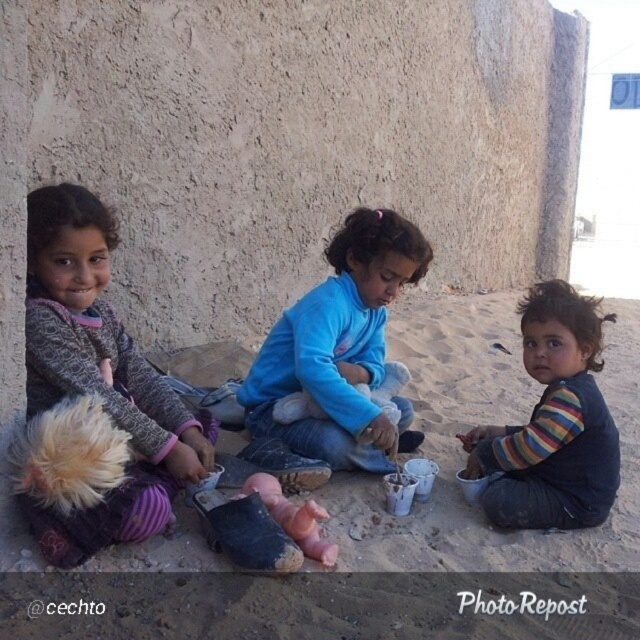
You are a photographer standing in front of the three children. You want to focus your camera on the point closer to you between point [388,524] and point [506,428]. Which point should you choose?

Point [388,524] is closer to the camera than point [506,428], so you should focus on point [388,524].

You are a photographer setting up a tripod to take a group photo of the children. The tripod has a width of 1.2 meters. You want to position the tripod so that it fits between the blue fleece jacket at center and the knitted gray sweater at left without overlapping either. Based on the scene description, is this possible?

The blue fleece jacket at center might be wider than knitted gray sweater at left, so the distance between them is uncertain. Therefore, it is not possible to confirm if the tripod with 1.2 meters width can fit between them without more information about the actual spacing.